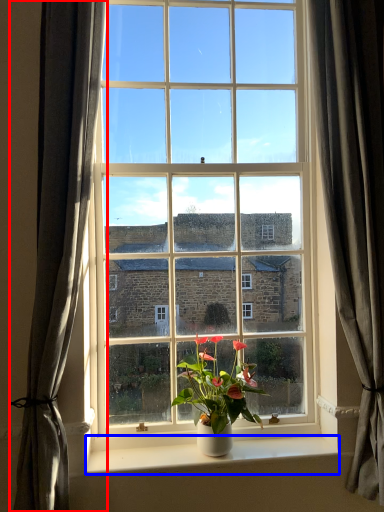
Question: Which of the following is the farthest to the observer, curtain (highlighted by a red box) or window sill (highlighted by a blue box)?

Choices:
 (A) curtain
 (B) window sill

Answer: (B)